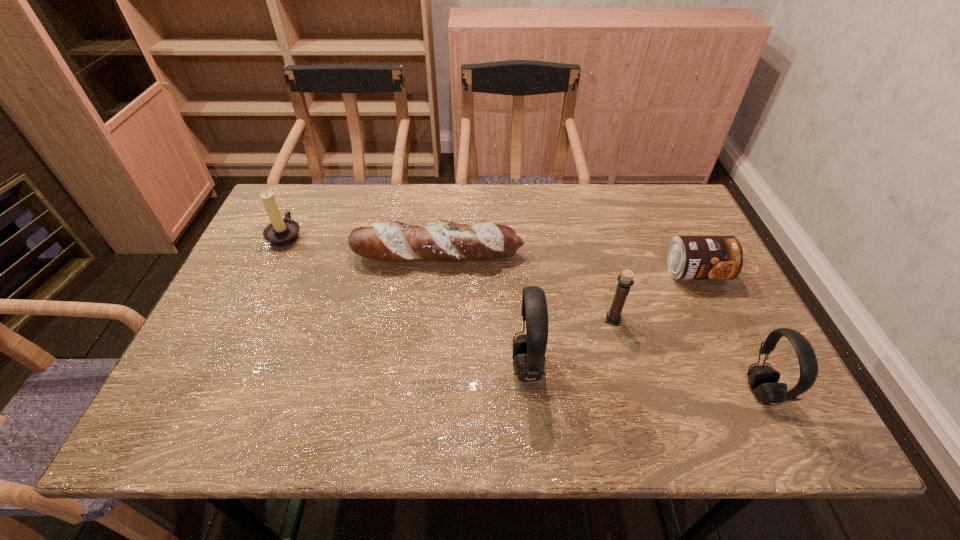
Find the location of `free space at the far right corner of the desktop`. free space at the far right corner of the desktop is located at coordinates (648, 219).

Where is `vacant space that's between the right headset and the can`? vacant space that's between the right headset and the can is located at coordinates (729, 332).

Identify the location of free area in between the fourth object from left to right and the baguet. This screenshot has width=960, height=540. (525, 287).

I want to click on free space between the baguet and the right headset, so click(x=599, y=323).

The width and height of the screenshot is (960, 540). Identify the location of free space between the baguet and the can. (566, 264).

The width and height of the screenshot is (960, 540). I want to click on free space between the baguet and the right headset, so click(599, 323).

The width and height of the screenshot is (960, 540). Find the location of `free space between the nearer candle holder and the baguet`. free space between the nearer candle holder and the baguet is located at coordinates (525, 287).

The width and height of the screenshot is (960, 540). I want to click on vacant area that lies between the tallest object and the leftmost object, so click(407, 301).

Find the location of a particular element. The width and height of the screenshot is (960, 540). free space that is in between the leftmost object and the fourth object from left to right is located at coordinates (449, 277).

Locate an element on the screen. This screenshot has height=540, width=960. free spot between the left headset and the right headset is located at coordinates (644, 379).